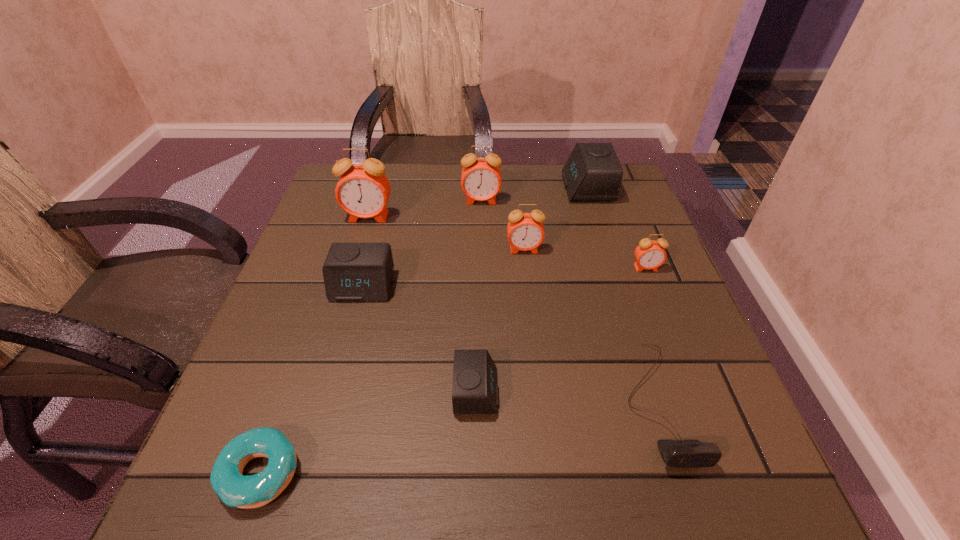
Identify the location of the second biggest black alarm clock. This screenshot has height=540, width=960. [x=353, y=272].

Locate an element on the screen. This screenshot has width=960, height=540. the leftmost black alarm clock is located at coordinates (353, 272).

I want to click on the smallest black alarm clock, so click(475, 390).

Image resolution: width=960 pixels, height=540 pixels. In order to click on the nearest black alarm clock in this screenshot , I will do `click(475, 390)`.

The image size is (960, 540). In order to click on webcam in this screenshot , I will do `click(676, 453)`.

Find the location of a particular element. the shortest object is located at coordinates (234, 489).

Find the location of `free spot located on the face of the tallest alarm clock`. free spot located on the face of the tallest alarm clock is located at coordinates (345, 296).

Find the location of a particular element. The width and height of the screenshot is (960, 540). vacant space situated 0.110m on the face of the second tallest alarm clock is located at coordinates (481, 233).

Image resolution: width=960 pixels, height=540 pixels. Find the location of `vacant space located on the face of the fifth shortest alarm clock`. vacant space located on the face of the fifth shortest alarm clock is located at coordinates (531, 308).

At what (x,y) coordinates should I click in order to perform the action: click on free spot located on the front-facing side of the biggest black alarm clock. Please return your answer as a coordinate pair (x, y). This screenshot has width=960, height=540. Looking at the image, I should click on (545, 188).